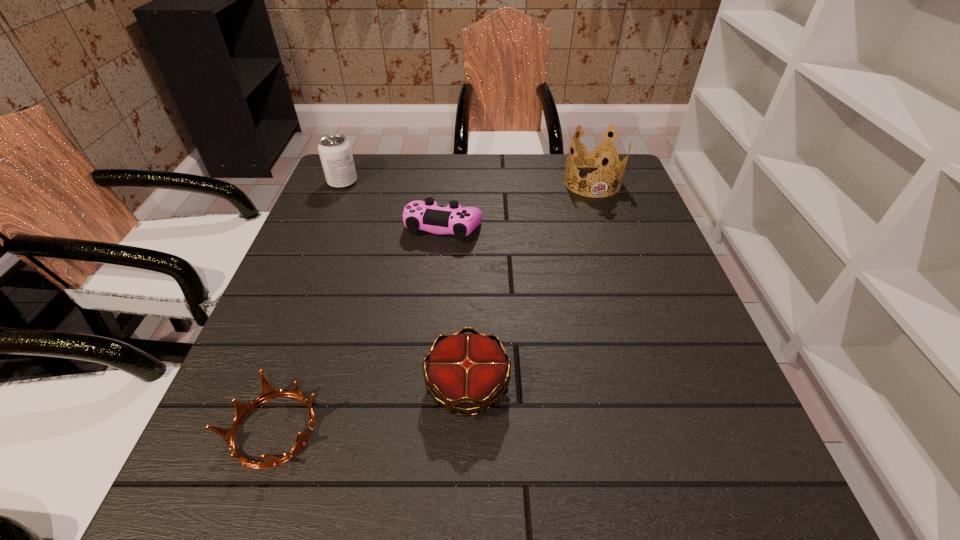
In order to click on object that is at the far right corner in this screenshot , I will do `click(597, 155)`.

Image resolution: width=960 pixels, height=540 pixels. Identify the location of vacant space at the far edge of the desktop. (561, 183).

In the image, there is a desktop. At what (x,y) coordinates should I click in order to perform the action: click on vacant space at the near edge. Please return your answer as a coordinate pair (x, y). The width and height of the screenshot is (960, 540). Looking at the image, I should click on (656, 489).

The image size is (960, 540). What are the coordinates of `vacant space at the left edge of the desktop` in the screenshot? It's located at (280, 282).

In the image, there is a desktop. What are the coordinates of `vacant space at the right edge` in the screenshot? It's located at (612, 251).

Locate an element on the screen. Image resolution: width=960 pixels, height=540 pixels. vacant space at the far left corner of the desktop is located at coordinates (342, 199).

In the image, there is a desktop. Where is `vacant space at the far right corner`? The image size is (960, 540). vacant space at the far right corner is located at coordinates (612, 197).

In order to click on free spot between the shortest object and the third nearest object in this screenshot , I will do `click(359, 328)`.

Find the location of `free area in between the second shortest crown and the soda can`. free area in between the second shortest crown and the soda can is located at coordinates (405, 284).

In order to click on vacant space that's between the control and the second crown from left to right in this screenshot , I will do [456, 306].